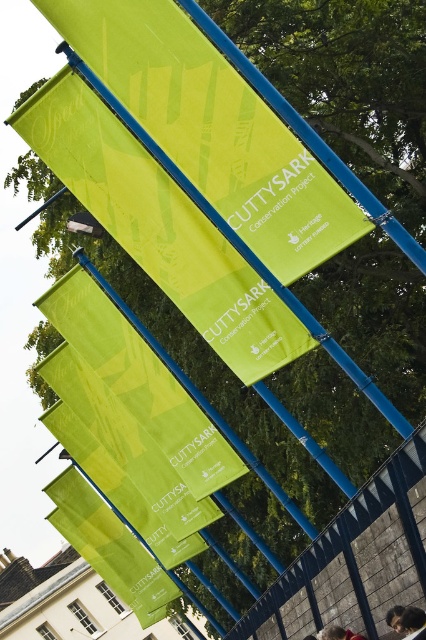
Does green fabric banner at center appear on the left side of reddish-brown leather jacket at lower center?

Indeed, green fabric banner at center is positioned on the left side of reddish-brown leather jacket at lower center.

Is the position of green fabric banner at center less distant than that of reddish-brown leather jacket at lower center?

That is True.

Where is `green fabric banner at center`? The image size is (426, 640). green fabric banner at center is located at coordinates (213, 129).

Locate an element on the screen. The height and width of the screenshot is (640, 426). green fabric banner at center is located at coordinates (213, 129).

The width and height of the screenshot is (426, 640). What do you see at coordinates (354, 557) in the screenshot?
I see `blue metal fence at center` at bounding box center [354, 557].

Does blue metal fence at center have a smaller size compared to dark brown hair at lower right?

Actually, blue metal fence at center might be larger than dark brown hair at lower right.

Between point (264, 616) and point (402, 621), which one is positioned behind?

The point (264, 616) is more distant.

I want to click on blue metal fence at center, so click(x=354, y=557).

Is blue metal fence at center smaller than reddish-brown leather jacket at lower center?

No.

Does blue metal fence at center have a lesser height compared to reddish-brown leather jacket at lower center?

Incorrect, blue metal fence at center's height does not fall short of reddish-brown leather jacket at lower center's.

The image size is (426, 640). I want to click on blue metal fence at center, so click(x=354, y=557).